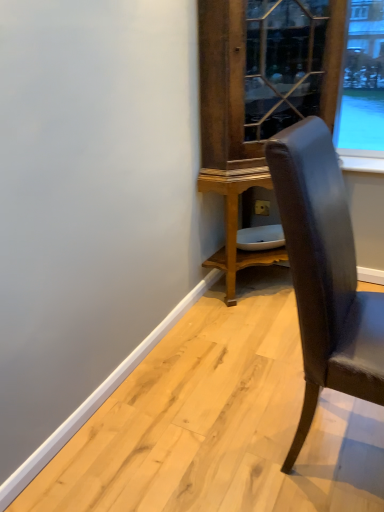
At what (x,y) coordinates should I click in order to perform the action: click on vacant space underneath leather chair at right (from a real-world perspective). Please return your answer as a coordinate pair (x, y). This screenshot has width=384, height=512. Looking at the image, I should click on (330, 448).